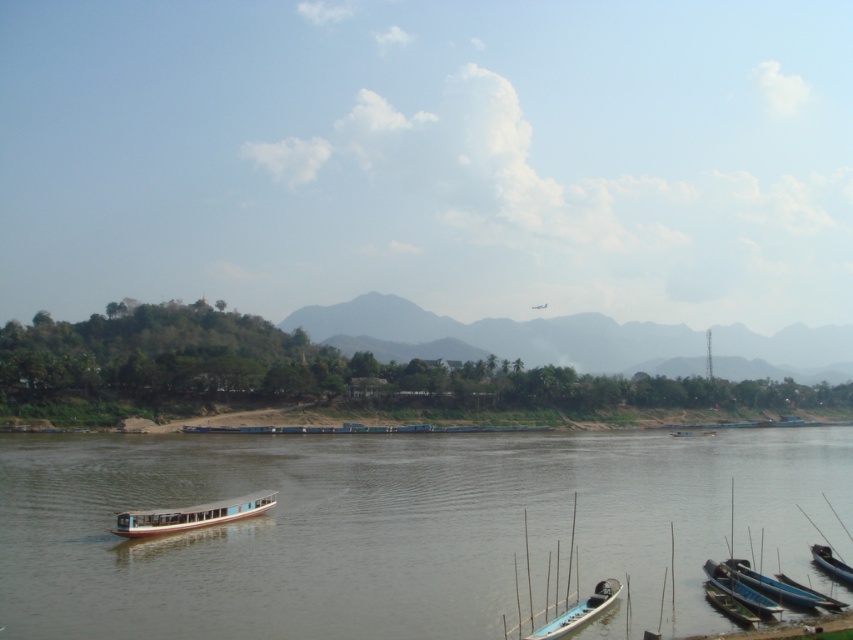
Is blue polished wood canoe at lower right above green wooden canoe at lower right?

Yes, blue polished wood canoe at lower right is above green wooden canoe at lower right.

From the picture: Is blue polished wood canoe at lower right closer to the viewer compared to green wooden canoe at lower right?

That is False.

Is point (705, 561) positioned in front of point (729, 609)?

No.

Locate an element on the screen. The height and width of the screenshot is (640, 853). blue polished wood canoe at lower right is located at coordinates (740, 589).

Consider the image. Is wooden polished boat at center wider than blue polished wood canoe at lower right?

Yes.

Does wooden polished boat at center have a lesser height compared to blue polished wood canoe at lower right?

No.

Describe the element at coordinates (190, 515) in the screenshot. The image size is (853, 640). I see `wooden polished boat at center` at that location.

The width and height of the screenshot is (853, 640). In order to click on wooden polished boat at center in this screenshot , I will do `click(190, 515)`.

Where is `wooden polished boat at center`? This screenshot has height=640, width=853. wooden polished boat at center is located at coordinates (190, 515).

Can you confirm if wooden polished boat at center is bigger than black glossy boat at lower right?

Yes.

Who is more forward, (251, 500) or (817, 561)?

Point (817, 561) is in front.

Locate an element on the screen. The height and width of the screenshot is (640, 853). wooden polished boat at center is located at coordinates (190, 515).